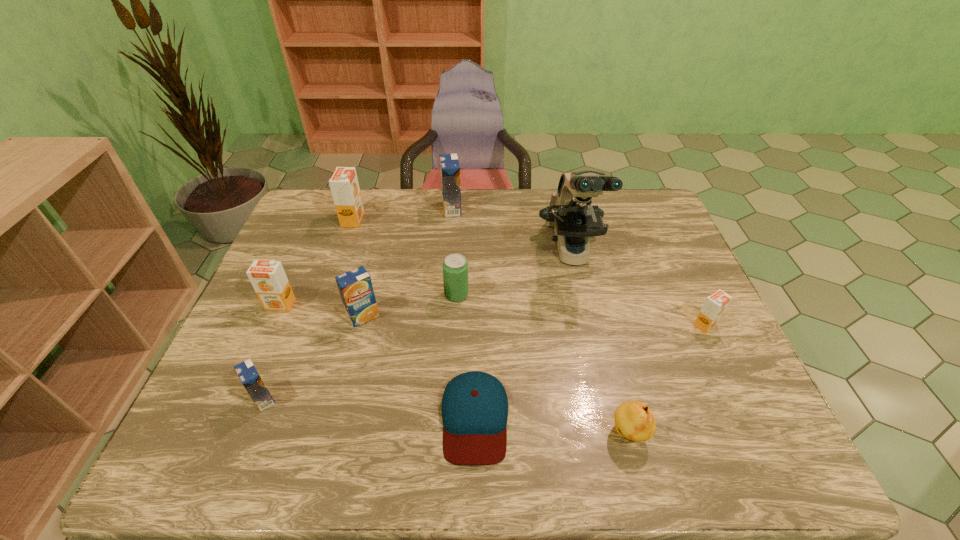
Identify the location of free space between the soda and the rightmost orange orange juice. (581, 310).

Find the location of a particular element. vacant space in between the shortest object and the pear is located at coordinates 552,426.

Find the location of `free area in between the seventh object from right to left and the farthest blue orange_juice`. free area in between the seventh object from right to left and the farthest blue orange_juice is located at coordinates (407, 262).

This screenshot has width=960, height=540. I want to click on the seventh closest object relative to the second biggest orange orange juice, so click(570, 211).

You are a GUI agent. You are given a task and a screenshot of the screen. Output one action in this format:
    pyautogui.click(x=<x>, y=<y>)
    Task: Click on the object that stands as the fourth closest to the rightmost orange juice
    Image resolution: width=960 pixels, height=540 pixels.
    Given the screenshot: What is the action you would take?
    coord(455,267)

This screenshot has width=960, height=540. I want to click on the fifth closest orange juice to the farthest orange orange juice, so click(x=715, y=305).

Identify the location of orange juice that is the fifth closest to the third orange juice from right to left. The height and width of the screenshot is (540, 960). (715, 305).

Select which blue orange_juice is the second closest to the leftmost orange orange juice. Please provide its 2D coordinates. Your answer should be formatted as a tuple, i.e. [(x, y)], where the tuple contains the x and y coordinates of a point satisfying the conditions above.

[(248, 374)]

I want to click on the closest blue orange_juice to the nearest orange juice, so click(x=355, y=286).

Select which orange orange juice appears as the closest to the soda. Please provide its 2D coordinates. Your answer should be formatted as a tuple, i.e. [(x, y)], where the tuple contains the x and y coordinates of a point satisfying the conditions above.

[(344, 185)]